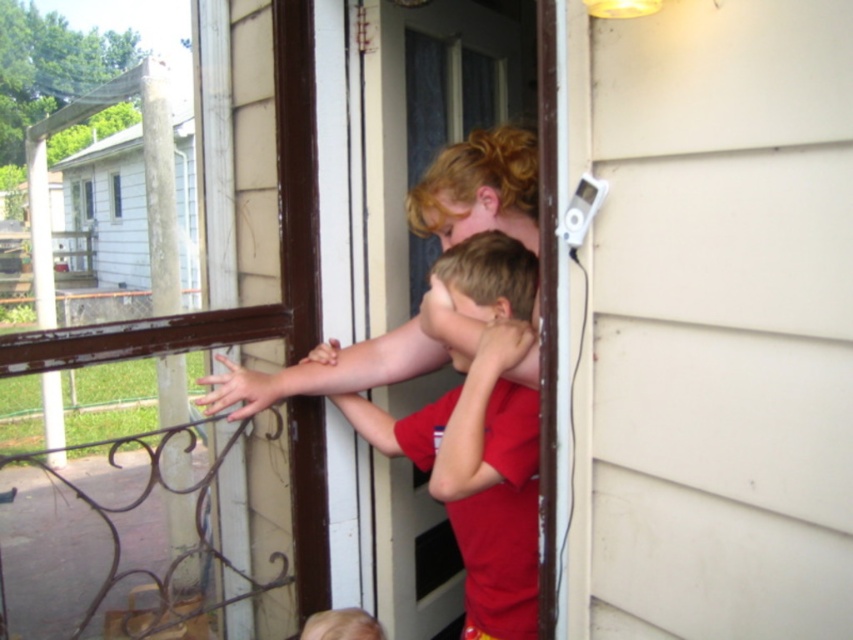
Between white plastic screen door at upper right and transparent plastic screen door at center, which one has less height?

Standing shorter between the two is white plastic screen door at upper right.

Is white plastic screen door at upper right below transparent plastic screen door at center?

Yes, white plastic screen door at upper right is below transparent plastic screen door at center.

Who is more forward, (836,248) or (380,340)?

Point (836,248)

This screenshot has width=853, height=640. In order to click on white plastic screen door at upper right in this screenshot , I will do `click(720, 317)`.